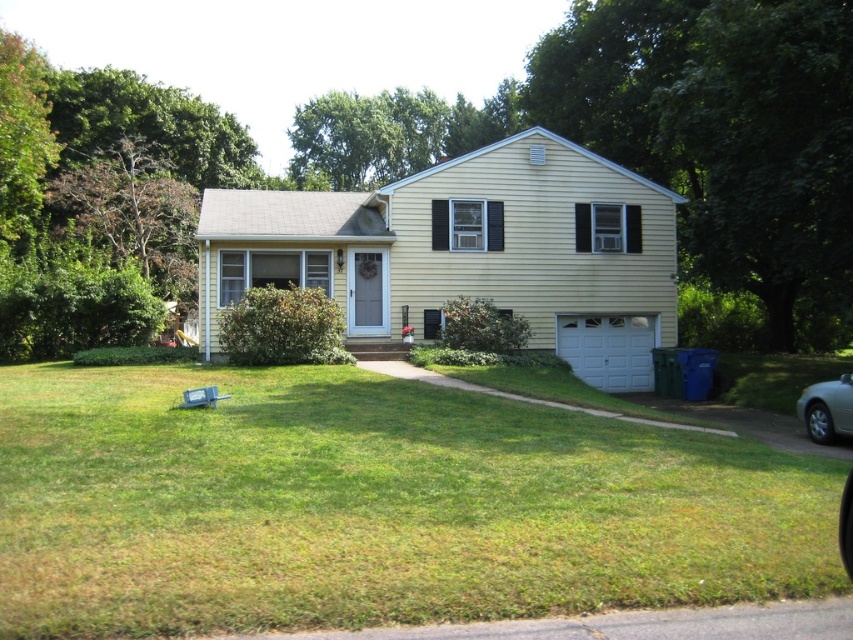
You are standing at the front door of the house and want to place a new potted plant exactly where the green grass at lower center is marked by point (373, 506). Is this location visible from the front door?

The point (373, 506) marks green grass at lower center, which is at the lower center of the image. Since you are standing at the front door, the lower center area would be directly in front of you, so yes, the location is visible from the front door.

You are a gardener planning to mow the lawn. The green grass at lower center and the silver metallic car at lower right are in your path. Which area should you avoid mowing to prevent damaging the car?

You should avoid mowing the area where the silver metallic car at lower right is located since the green grass at lower center is wider than the car, meaning the car is smaller and likely occupies less space, but the grass area is broader. However, the car itself should not be mowed over at all to prevent damage.